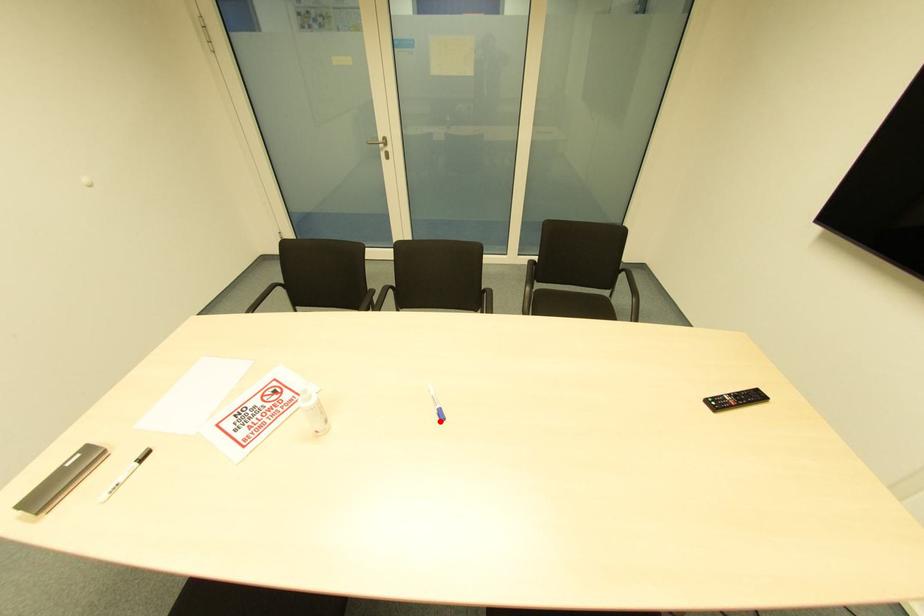
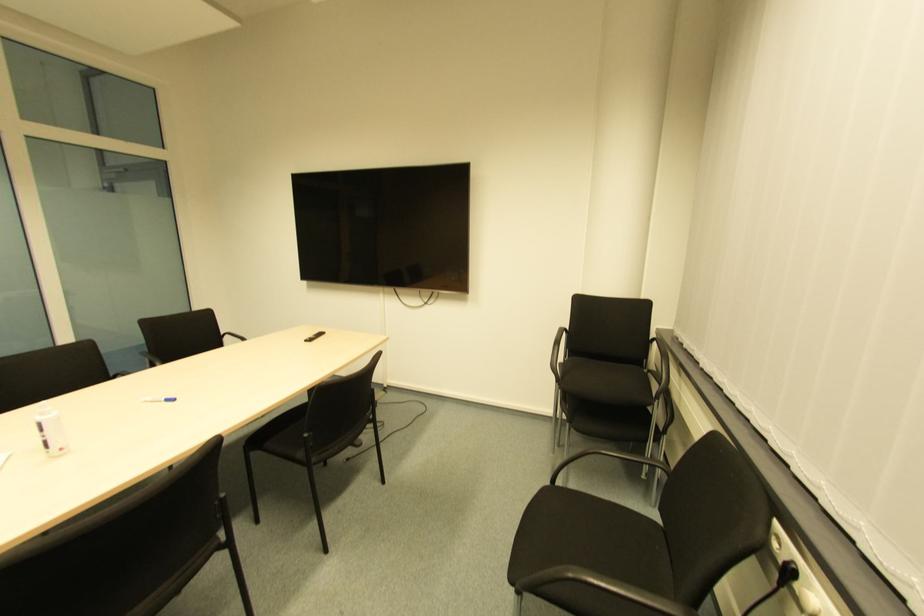
Where in the second image is the point corresponding to the highlighted location from the first image?

(172, 403)